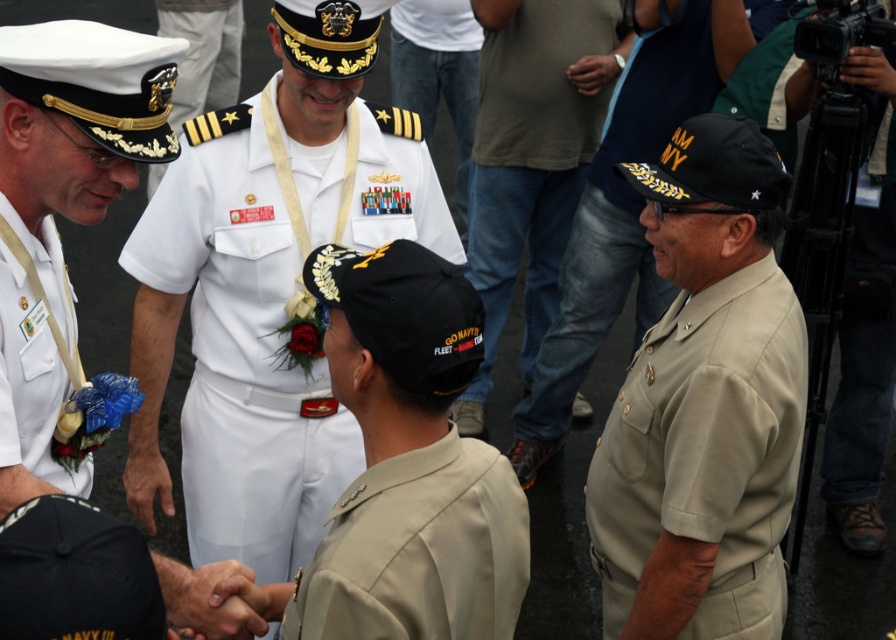
You are a photographer standing at the edge of the ceremony area. You want to take a photo that includes both the point at coordinates point (319, 612) and point (9, 316). Which point should you focus on first to ensure both are in frame?

You should focus on point (319, 612) first because it is closer to the viewer than point (9, 316), ensuring both points are within the camera frame.

Looking at the scene described, which uniform is positioned to the left when comparing the white cotton dress uniform at center and the tan fabric uniform at center?

The white cotton dress uniform at center is to the left of the tan fabric uniform at center according to the description.